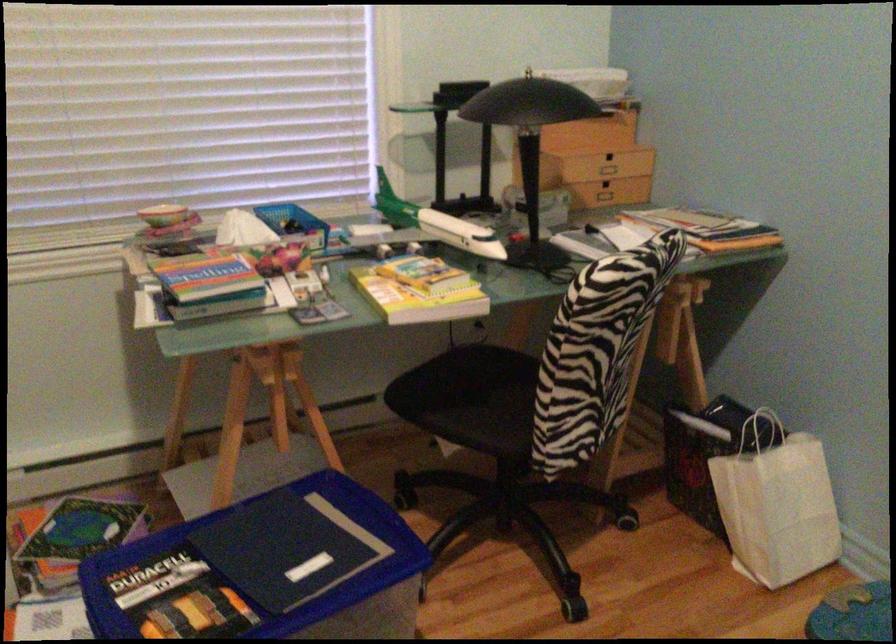
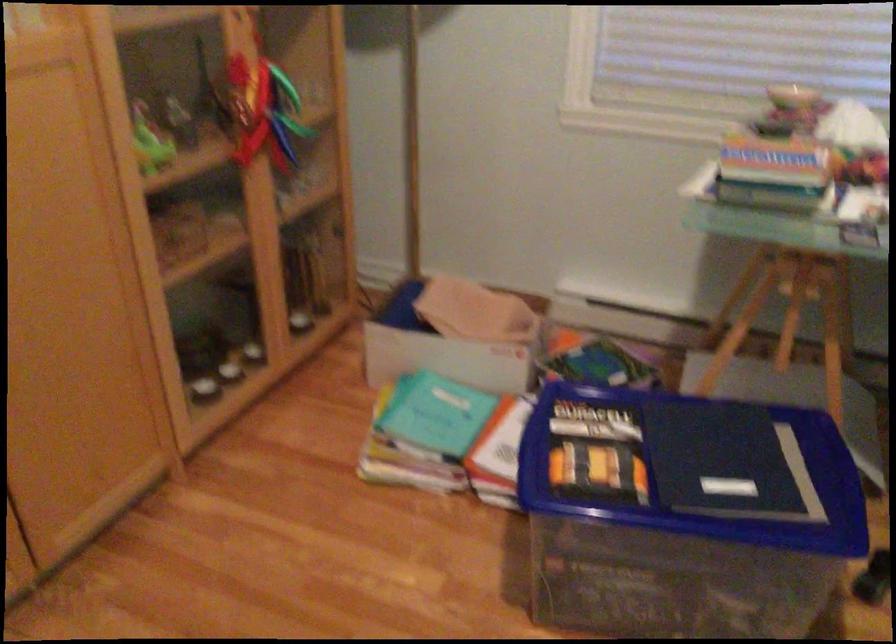
Question: The camera is either moving clockwise (left) or counter-clockwise (right) around the object. The first image is from the beginning of the video and the second image is from the end. Is the camera moving left or right when shooting the video?

Choices:
 (A) Left
 (B) Right

Answer: (B)